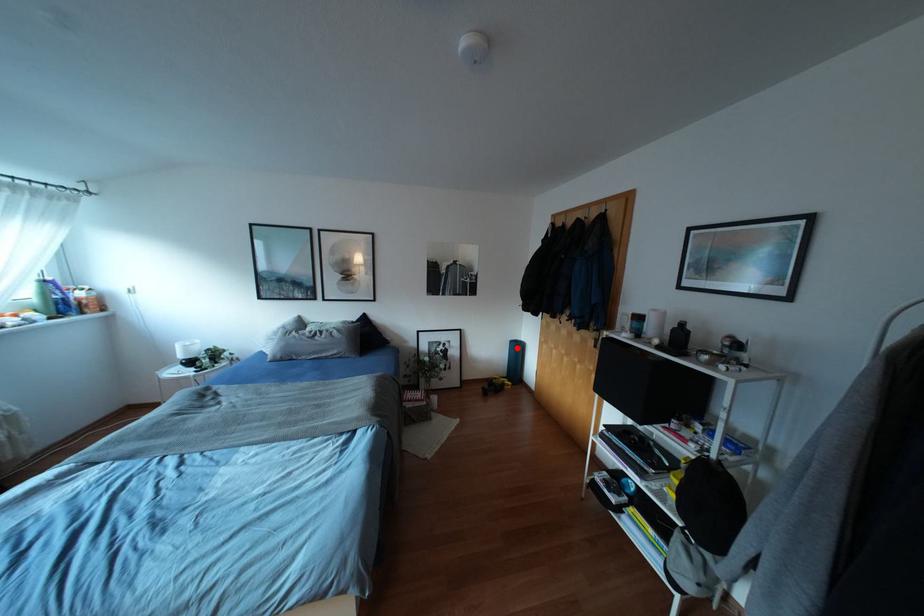
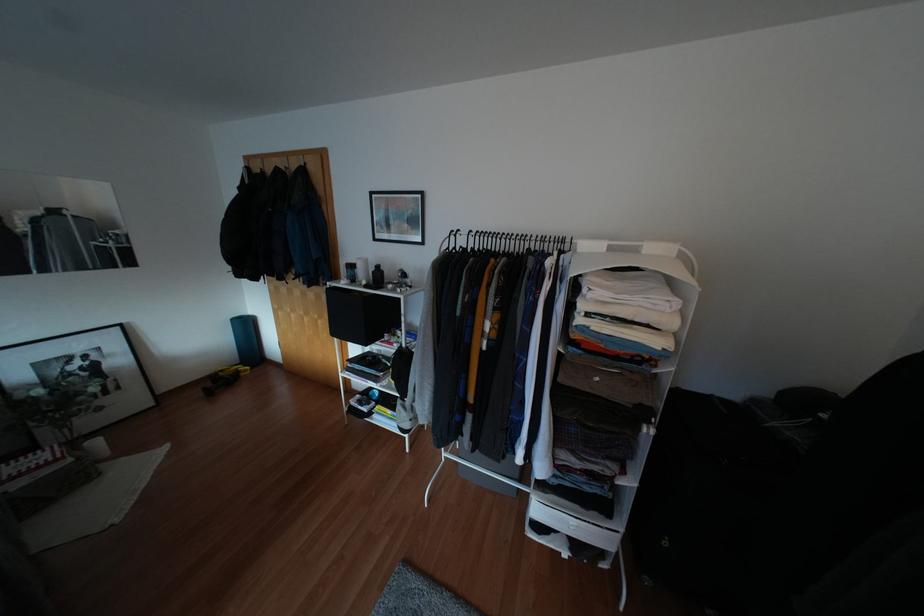
Question: A red point is marked in image1. In image2, is the corresponding 3D point closer to the camera or farther? Reply with the corresponding letter.

Choices:
 (A) The corresponding 3D point is closer.
 (B) The corresponding 3D point is farther.

Answer: (B)